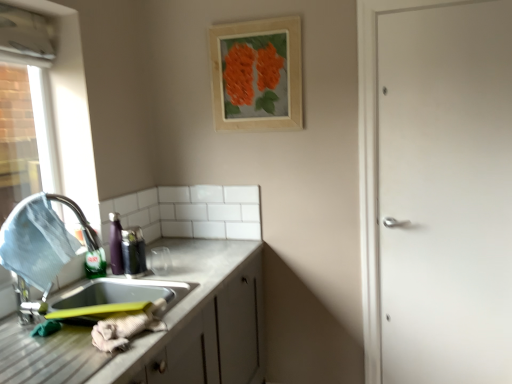
Question: Does white matte door at right lie in front of metallic stainless steel sink at lower left?

Choices:
 (A) yes
 (B) no

Answer: (B)

Question: Is white matte door at right at the right side of metallic stainless steel sink at lower left?

Choices:
 (A) yes
 (B) no

Answer: (A)

Question: Is the surface of white matte door at right in direct contact with metallic stainless steel sink at lower left?

Choices:
 (A) yes
 (B) no

Answer: (B)

Question: Does white matte door at right have a lesser width compared to metallic stainless steel sink at lower left?

Choices:
 (A) no
 (B) yes

Answer: (B)

Question: Is white matte door at right positioned behind metallic stainless steel sink at lower left?

Choices:
 (A) yes
 (B) no

Answer: (A)

Question: From a real-world perspective, is metallic stainless steel sink at left physically located above or below white matte door at right?

Choices:
 (A) above
 (B) below

Answer: (A)

Question: In the image, is metallic stainless steel sink at left on the left side or the right side of white matte door at right?

Choices:
 (A) right
 (B) left

Answer: (B)

Question: From the image's perspective, is metallic stainless steel sink at left positioned above or below white matte door at right?

Choices:
 (A) below
 (B) above

Answer: (A)

Question: Based on their sizes in the image, would you say metallic stainless steel sink at left is bigger or smaller than white matte door at right?

Choices:
 (A) small
 (B) big

Answer: (A)

Question: From the image's perspective, is metallic stainless steel sink at left located above or below wooden frame at upper center?

Choices:
 (A) below
 (B) above

Answer: (A)

Question: Which is correct: metallic stainless steel sink at left is inside wooden frame at upper center, or outside of it?

Choices:
 (A) inside
 (B) outside

Answer: (B)

Question: Is metallic stainless steel sink at left in front of or behind wooden frame at upper center in the image?

Choices:
 (A) behind
 (B) front

Answer: (B)

Question: Is point (25, 302) closer or farther from the camera than point (279, 94)?

Choices:
 (A) farther
 (B) closer

Answer: (B)

Question: In terms of height, does metallic stainless steel sink at lower left look taller or shorter compared to wooden frame at upper center?

Choices:
 (A) tall
 (B) short

Answer: (B)

Question: Looking at their shapes, would you say metallic stainless steel sink at lower left is wider or thinner than wooden frame at upper center?

Choices:
 (A) thin
 (B) wide

Answer: (B)